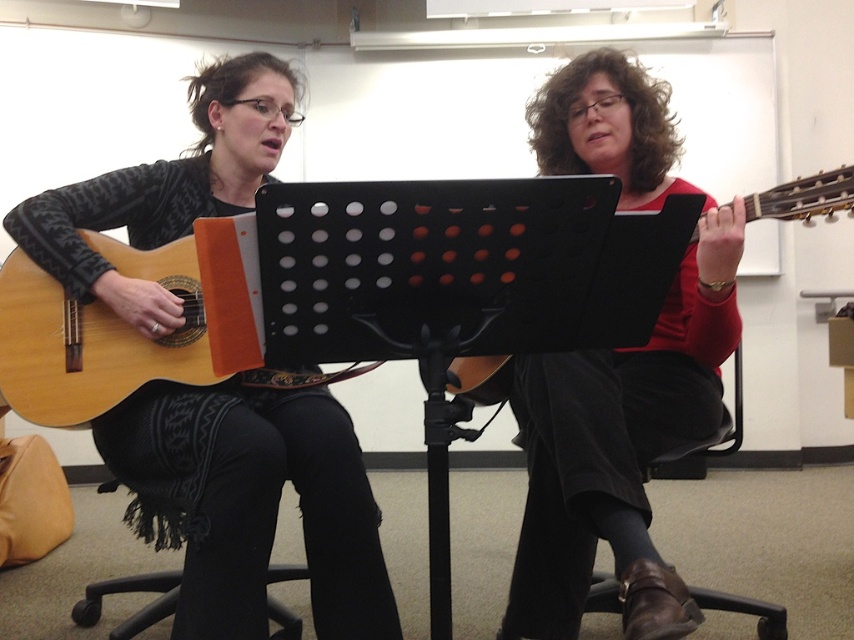
Looking at this image, you are a photographer setting up for a music session. You need to ensure that the matte brown guitar at right and the black leather chair at lower center are both visible in your shot. Given their heights, which object will appear taller in the photo?

The matte brown guitar at right appears taller in the photo because it has a greater height compared to the black leather chair at lower center.

You are a music teacher who needs to move a 24 inch wide amplifier between the matte black guitar at left and the black fabric bar stool at lower left. Can the amplifier fit through the space between them?

The space between the matte black guitar at left and the black fabric bar stool at lower left is 25.68 inches. Since the amplifier is 24 inches wide, it can fit through the space between them.

You are a photographer setting up for a group photo in this music session scene. You need to ensure that the matte black guitar at left and the matte red sweater at center are both visible in the frame. Based on their positions, which object is closer to the bottom edge of the photo?

The matte black guitar at left is positioned under the matte red sweater at center, so it is closer to the bottom edge of the photo.